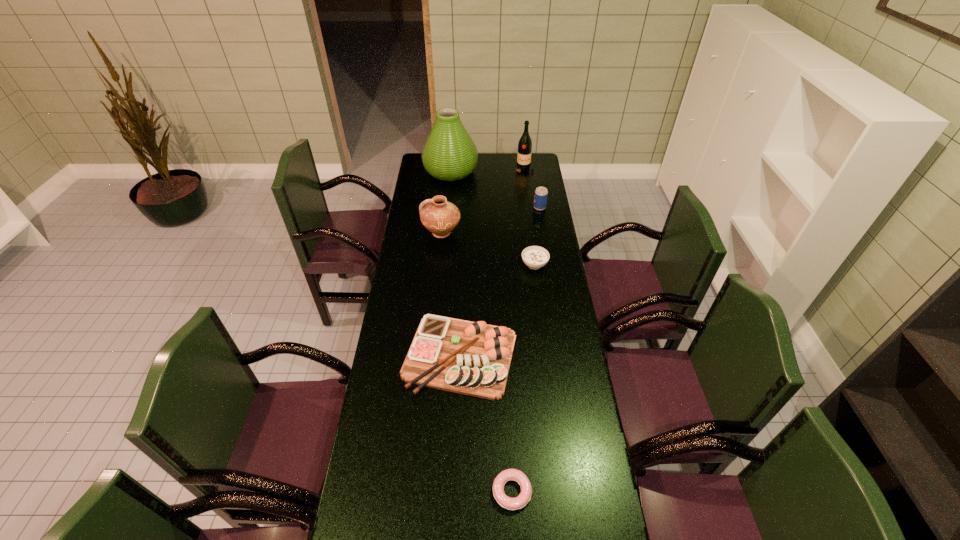
Image resolution: width=960 pixels, height=540 pixels. Find the location of `vacant area at the right edge`. vacant area at the right edge is located at coordinates (531, 238).

At what (x,y) coordinates should I click in order to perform the action: click on free space at the far right corner. Please return your answer as a coordinate pair (x, y). The height and width of the screenshot is (540, 960). Looking at the image, I should click on (540, 173).

The height and width of the screenshot is (540, 960). I want to click on free spot between the vase and the wine bottle, so click(x=488, y=170).

This screenshot has height=540, width=960. Find the location of `free spot between the wine bottle and the fifth farthest object`. free spot between the wine bottle and the fifth farthest object is located at coordinates (530, 217).

Identify the location of free space between the vase and the third shortest object. Image resolution: width=960 pixels, height=540 pixels. (455, 263).

I want to click on free space between the wine bottle and the nearest object, so click(518, 330).

Identify the location of free space that is in between the second shortest object and the sixth farthest object. The width and height of the screenshot is (960, 540). (497, 310).

The image size is (960, 540). What are the coordinates of `free space between the soup bowl and the second tallest object` in the screenshot? It's located at (530, 217).

Locate an element on the screen. empty space between the second shortest object and the platter is located at coordinates (497, 310).

Identify the location of object identified as the fifth closest to the fourth shortest object. (472, 358).